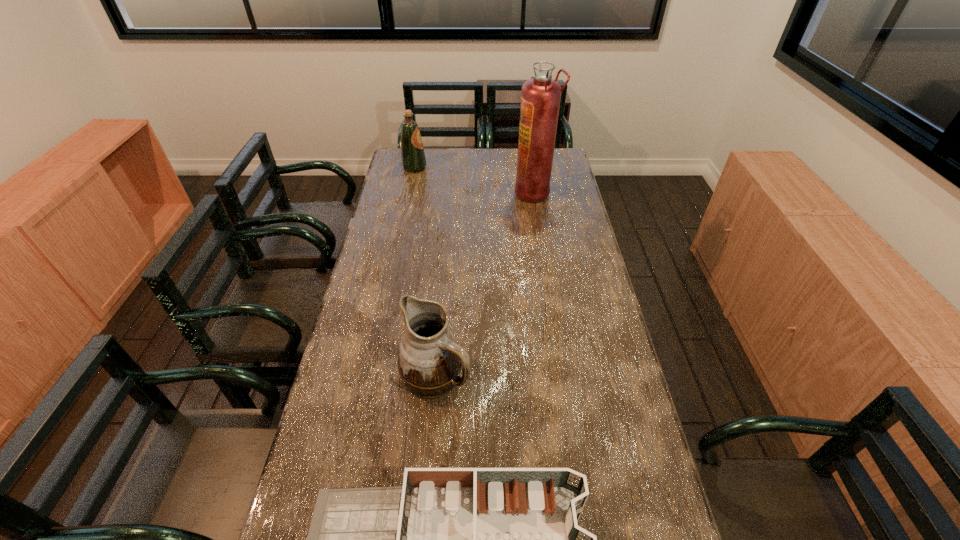
I want to click on free space between the pitcher and the olive oil, so click(425, 271).

In order to click on vacant area that lies between the olive oil and the fire extinguisher in this screenshot , I will do `click(474, 180)`.

Locate an element on the screen. The height and width of the screenshot is (540, 960). object that stands as the third closest to the olive oil is located at coordinates (450, 539).

Identify the location of object that can be found as the second closest to the tallest object. (429, 360).